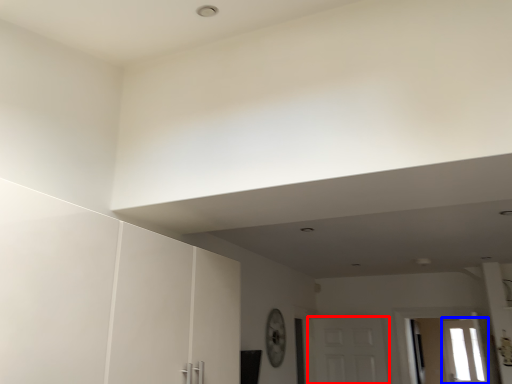
Question: Which of the following is the closest to the observer, door (highlighted by a red box) or window (highlighted by a blue box)?

Choices:
 (A) door
 (B) window

Answer: (A)